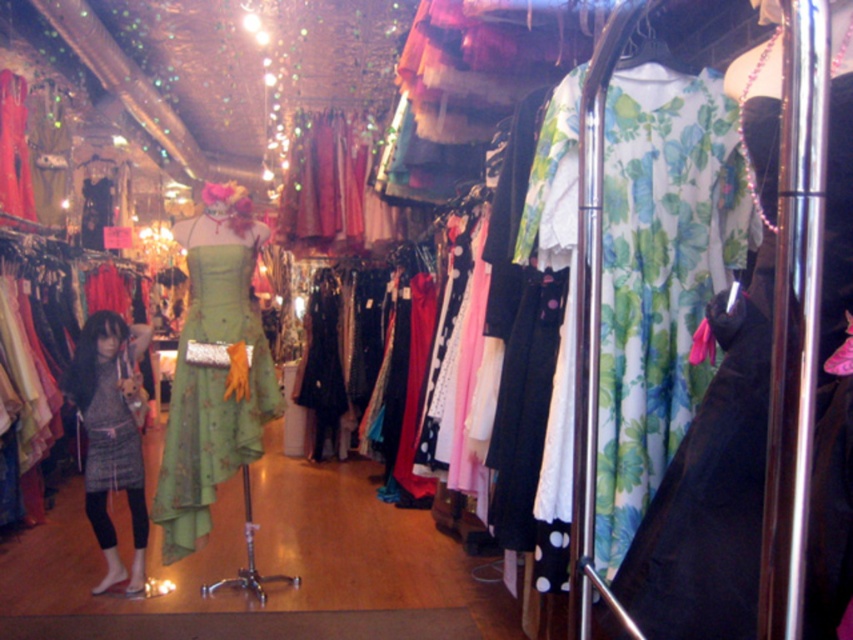
Can you confirm if green floral fabric dress at right is positioned to the left of gray textured dress at center?

Incorrect, green floral fabric dress at right is not on the left side of gray textured dress at center.

Is green floral fabric dress at right bigger than gray textured dress at center?

No.

Does point (833, 230) lie in front of point (96, 392)?

Yes, it is.

Locate an element on the screen. green floral fabric dress at right is located at coordinates (711, 490).

Is green floral fabric dress at center smaller than gray textured dress at center?

No, green floral fabric dress at center is not smaller than gray textured dress at center.

Between green floral fabric dress at center and gray textured dress at center, which one appears on the left side from the viewer's perspective?

From the viewer's perspective, gray textured dress at center appears more on the left side.

Between point (219, 476) and point (103, 406), which one is positioned behind?

The point (103, 406) is behind.

At what (x,y) coordinates should I click in order to perform the action: click on green floral fabric dress at center. Please return your answer as a coordinate pair (x, y). This screenshot has height=640, width=853. Looking at the image, I should click on (213, 381).

Between green floral fabric dress at right and green floral fabric dress at center, which one appears on the right side from the viewer's perspective?

green floral fabric dress at right

Does green floral fabric dress at right appear on the left side of green floral fabric dress at center?

In fact, green floral fabric dress at right is to the right of green floral fabric dress at center.

You are a GUI agent. You are given a task and a screenshot of the screen. Output one action in this format:
    pyautogui.click(x=<x>, y=<y>)
    Task: Click on the green floral fabric dress at right
    
    Given the screenshot: What is the action you would take?
    pyautogui.click(x=711, y=490)

Where is `green floral fabric dress at right`? This screenshot has width=853, height=640. green floral fabric dress at right is located at coordinates (711, 490).